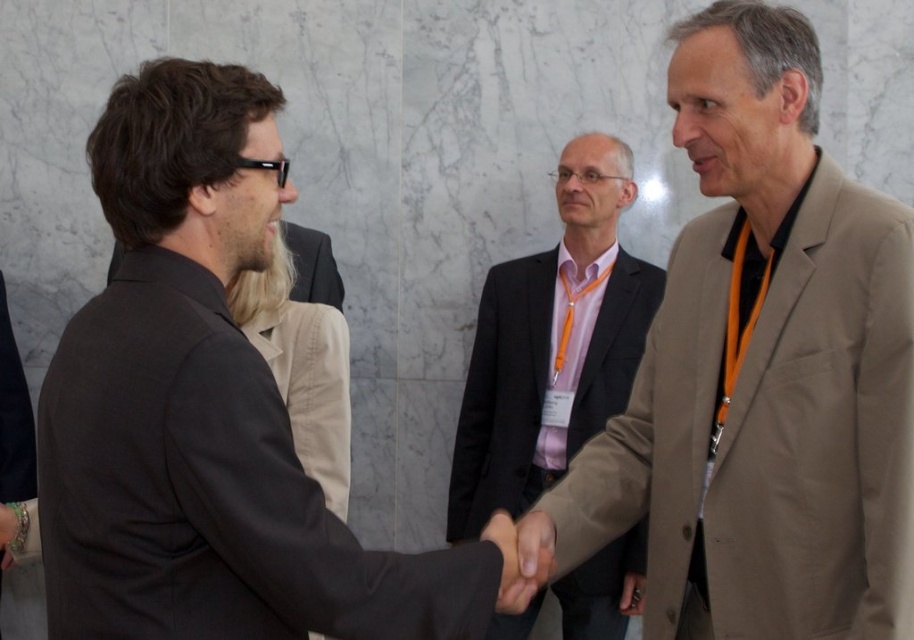
The width and height of the screenshot is (914, 640). What do you see at coordinates (758, 369) in the screenshot?
I see `beige fabric suit at right` at bounding box center [758, 369].

Can you confirm if beige fabric suit at right is taller than matte black suit at left?

Indeed, beige fabric suit at right has a greater height compared to matte black suit at left.

Image resolution: width=914 pixels, height=640 pixels. What do you see at coordinates (758, 369) in the screenshot? I see `beige fabric suit at right` at bounding box center [758, 369].

The width and height of the screenshot is (914, 640). What are the coordinates of `beige fabric suit at right` in the screenshot? It's located at (758, 369).

Between beige fabric suit at right and dark gray suit at center, which one has less height?

dark gray suit at center

Does beige fabric suit at right appear under dark gray suit at center?

Incorrect, beige fabric suit at right is not positioned below dark gray suit at center.

Does point (836, 632) come farther from viewer compared to point (457, 467)?

No, it is not.

The height and width of the screenshot is (640, 914). In order to click on beige fabric suit at right in this screenshot , I will do `click(758, 369)`.

Does point (252, 80) come behind point (619, 332)?

No, (252, 80) is in front of (619, 332).

Which is in front, point (251, 566) or point (626, 572)?

Point (251, 566) is in front.

Locate an element on the screen. The image size is (914, 640). matte black suit at left is located at coordinates (207, 410).